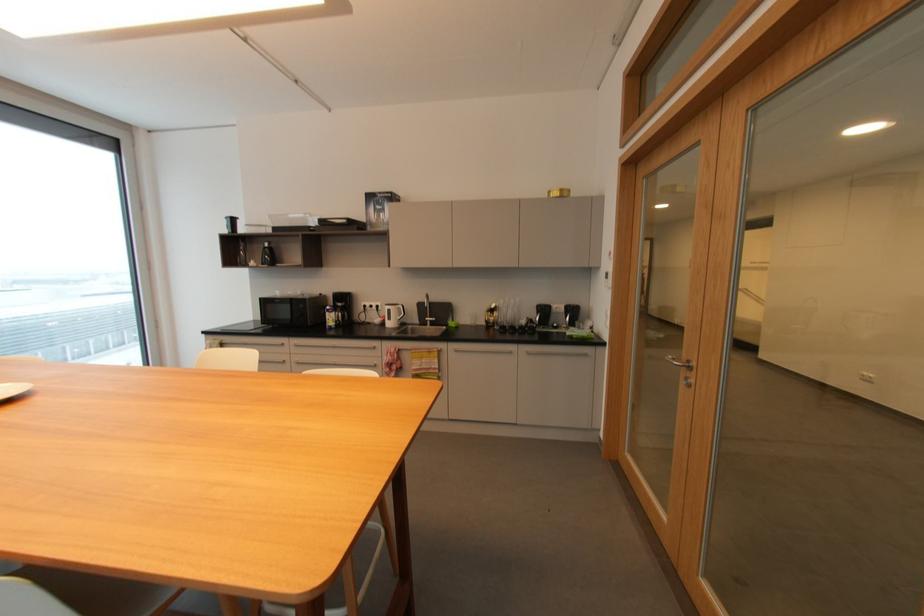
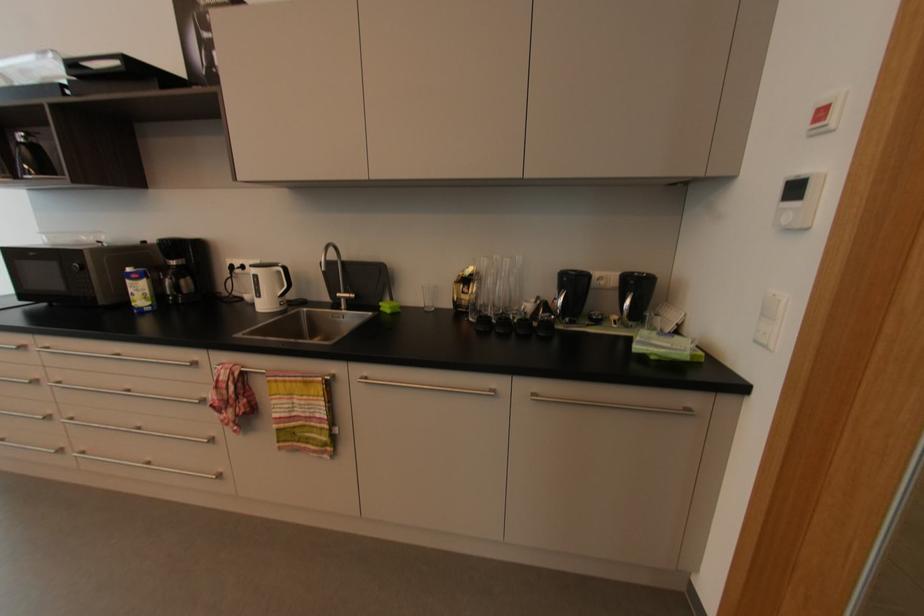
Locate, in the second image, the point that corresponds to pixel 530 352 in the first image.

(537, 395)